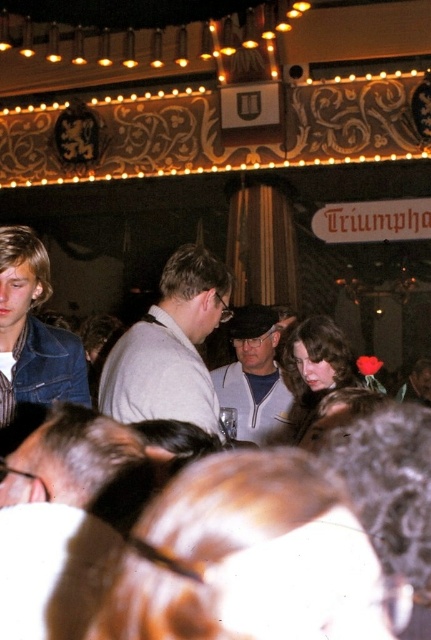
Question: Which point is farther to the camera?

Choices:
 (A) (18, 243)
 (B) (252, 394)

Answer: (B)

Question: Which object is positioned farthest from the gray fabric jacket at center?

Choices:
 (A) faded denim jacket at lower right
 (B) gray fabric shirt at center

Answer: (A)

Question: Does faded denim jacket at lower right appear on the left side of gray fabric jacket at center?

Choices:
 (A) yes
 (B) no

Answer: (A)

Question: Does gray fabric shirt at center lie in front of faded denim jacket at lower right?

Choices:
 (A) yes
 (B) no

Answer: (A)

Question: Which point appears closest to the camera in this image?

Choices:
 (A) (5, 422)
 (B) (275, 388)

Answer: (A)

Question: Can you confirm if faded denim jacket at lower right is thinner than gray fabric jacket at center?

Choices:
 (A) no
 (B) yes

Answer: (B)